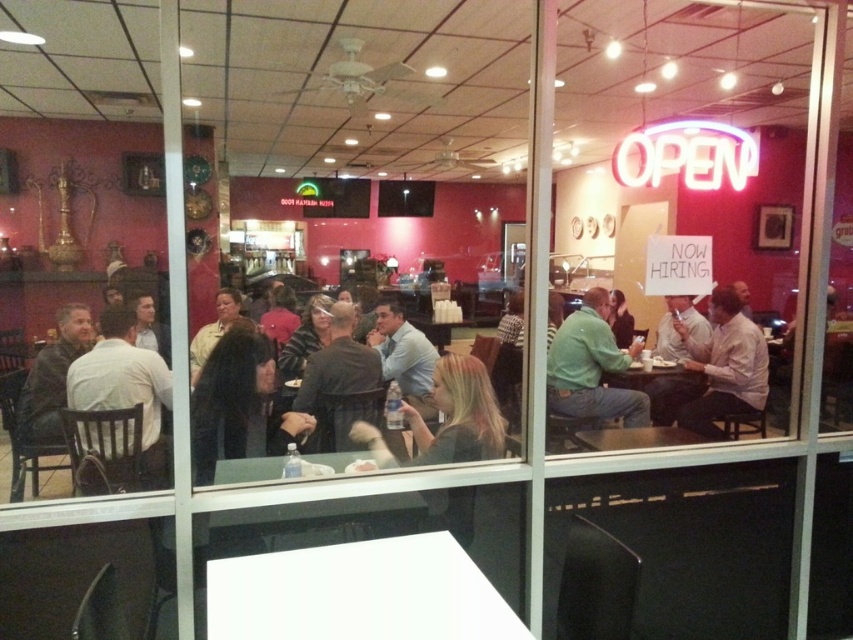
In the scene shown: Does neon sign at right have a lesser width compared to leather jacket at left?

Yes, neon sign at right is thinner than leather jacket at left.

From the picture: Between neon sign at right and leather jacket at left, which one is positioned higher?

leather jacket at left is higher up.

The image size is (853, 640). Identify the location of neon sign at right. (706, 292).

Is point (585, 436) closer to camera compared to point (238, 321)?

Yes, it is.

Is point (645, 436) farther from camera compared to point (231, 301)?

No, it is not.

Find the location of a particular element. smooth wooden table at center is located at coordinates (634, 436).

Based on the photo, between dark brown hair at center and white shirt at right, which one is positioned higher?

Positioned higher is white shirt at right.

Looking at this image, can you confirm if dark brown hair at center is positioned below white shirt at right?

Correct, dark brown hair at center is located below white shirt at right.

Which is behind, point (257, 404) or point (717, 333)?

Positioned behind is point (717, 333).

This screenshot has height=640, width=853. Find the location of `dark brown hair at center`. dark brown hair at center is located at coordinates (238, 404).